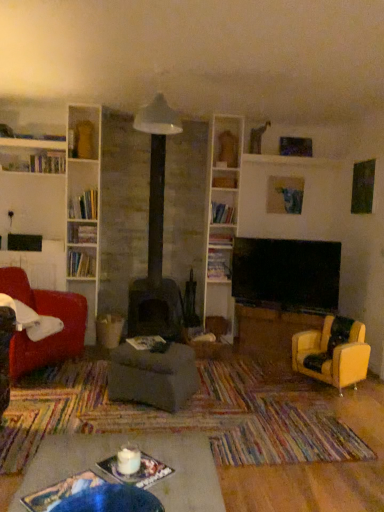
Question: Which direction should I rotate to look at wooden bookshelf at center, placed as the 2th shelf when sorted from left to right, — up or down?

Choices:
 (A) up
 (B) down

Answer: (B)

Question: Is matte blue painting at upper center placed right next to white glossy bookshelf at upper center, marked as the 2th shelf in a right-to-left arrangement?

Choices:
 (A) yes
 (B) no

Answer: (B)

Question: Is matte blue painting at upper center smaller than white glossy bookshelf at upper center, marked as the 2th shelf in a right-to-left arrangement?

Choices:
 (A) yes
 (B) no

Answer: (B)

Question: Is matte blue painting at upper center facing towards white glossy bookshelf at upper center, which ranks as the 3th shelf in left-to-right order?

Choices:
 (A) yes
 (B) no

Answer: (B)

Question: Is matte blue painting at upper center shorter than white glossy bookshelf at upper center, marked as the 2th shelf in a right-to-left arrangement?

Choices:
 (A) no
 (B) yes

Answer: (A)

Question: Is matte blue painting at upper center looking in the opposite direction of white glossy bookshelf at upper center, marked as the 2th shelf in a right-to-left arrangement?

Choices:
 (A) no
 (B) yes

Answer: (A)

Question: Does matte blue painting at upper center have a larger size compared to white glossy bookshelf at upper center, the 2th shelf when ordered from top to bottom?

Choices:
 (A) yes
 (B) no

Answer: (A)

Question: Does white glossy bookshelf at upper center, which ranks as the 3th shelf in left-to-right order, have a lesser height compared to wooden bookshelf at center, the first shelf in the bottom-to-top sequence?

Choices:
 (A) yes
 (B) no

Answer: (A)

Question: Is wooden bookshelf at center, the first shelf in the bottom-to-top sequence, located within white glossy bookshelf at upper center, which ranks as the 3th shelf in left-to-right order?

Choices:
 (A) yes
 (B) no

Answer: (B)

Question: Can you confirm if white glossy bookshelf at upper center, marked as the 2th shelf in a right-to-left arrangement, is positioned to the left of wooden bookshelf at center, the first shelf in the bottom-to-top sequence?

Choices:
 (A) no
 (B) yes

Answer: (A)

Question: From a real-world perspective, is white glossy bookshelf at upper center, which ranks as the 3th shelf in left-to-right order, located higher than wooden bookshelf at center, which is the 3th shelf in right-to-left order?

Choices:
 (A) yes
 (B) no

Answer: (A)

Question: Does white glossy bookshelf at upper center, marked as the 2th shelf in a right-to-left arrangement, have a larger size compared to wooden bookshelf at center, which is the 3th shelf in right-to-left order?

Choices:
 (A) yes
 (B) no

Answer: (B)

Question: Does white glossy bookshelf at upper center, the 2th shelf when ordered from top to bottom, have a smaller size compared to velvet red armchair at left, which is counted as the 1th chair, starting from the left?

Choices:
 (A) yes
 (B) no

Answer: (A)